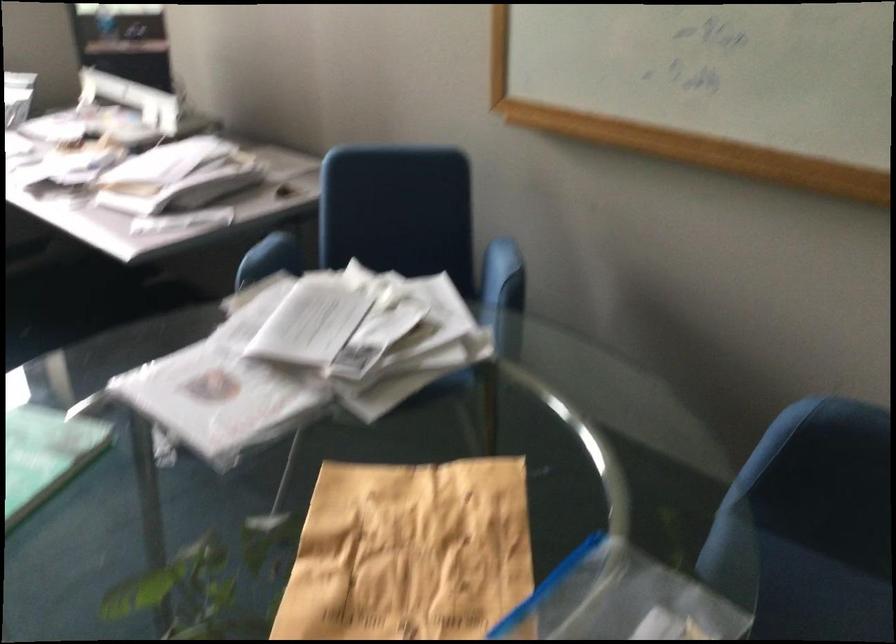
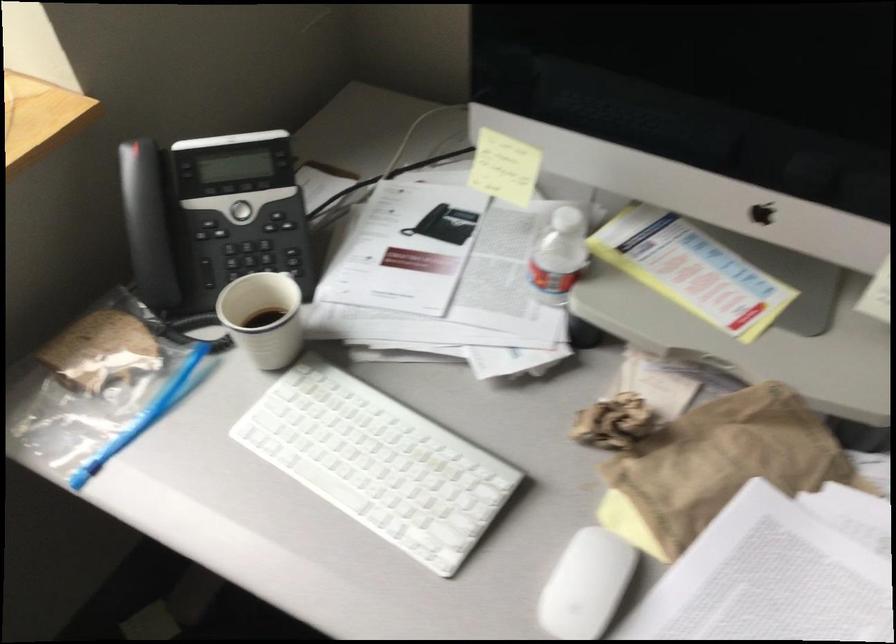
Locate, in the second image, the point that corresponds to (x=82, y=129) in the first image.

(718, 466)